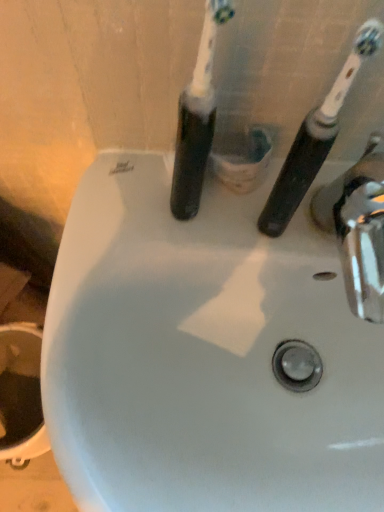
Locate an element on the screen. vacant space to the right of black plastic toothbrush at center, placed as the first toothbrush when sorted from left to right is located at coordinates (277, 210).